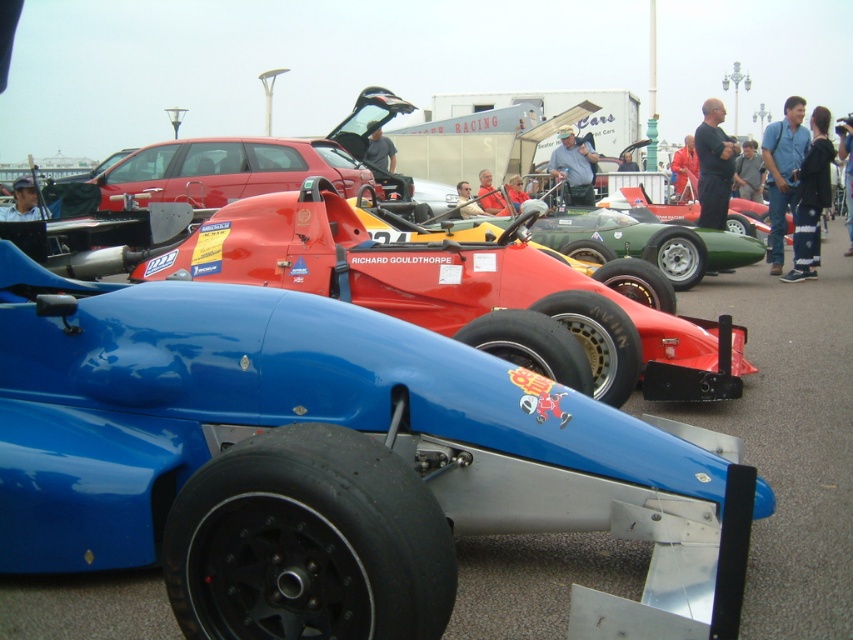
Who is positioned more to the right, shiny red racing car at center or matte red car at center?

shiny red racing car at center

Is shiny red racing car at center taller than matte red car at center?

Correct, shiny red racing car at center is much taller as matte red car at center.

I want to click on shiny red racing car at center, so click(x=457, y=289).

Does glossy blue race car at center have a lesser height compared to shiny red racing car at center?

Indeed, glossy blue race car at center has a lesser height compared to shiny red racing car at center.

Does glossy blue race car at center have a smaller size compared to shiny red racing car at center?

Indeed, glossy blue race car at center has a smaller size compared to shiny red racing car at center.

This screenshot has height=640, width=853. I want to click on glossy blue race car at center, so click(316, 458).

What do you see at coordinates (316, 458) in the screenshot?
I see `glossy blue race car at center` at bounding box center [316, 458].

Between point (378, 509) and point (160, 157), which one is positioned behind?

The point (160, 157) is behind.

At what (x,y) coordinates should I click in order to perform the action: click on glossy blue race car at center. Please return your answer as a coordinate pair (x, y). This screenshot has width=853, height=640. Looking at the image, I should click on (316, 458).